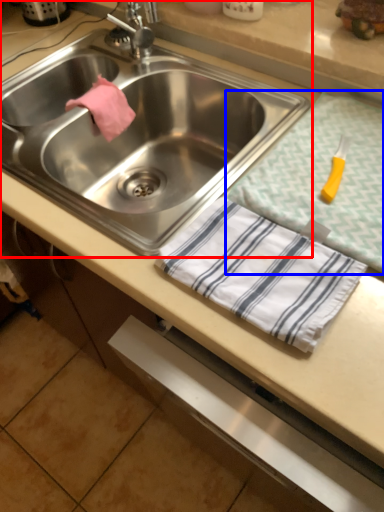
Question: Among these objects, which one is farthest to the camera, sink (highlighted by a red box) or tablecloth (highlighted by a blue box)?

Choices:
 (A) sink
 (B) tablecloth

Answer: (A)